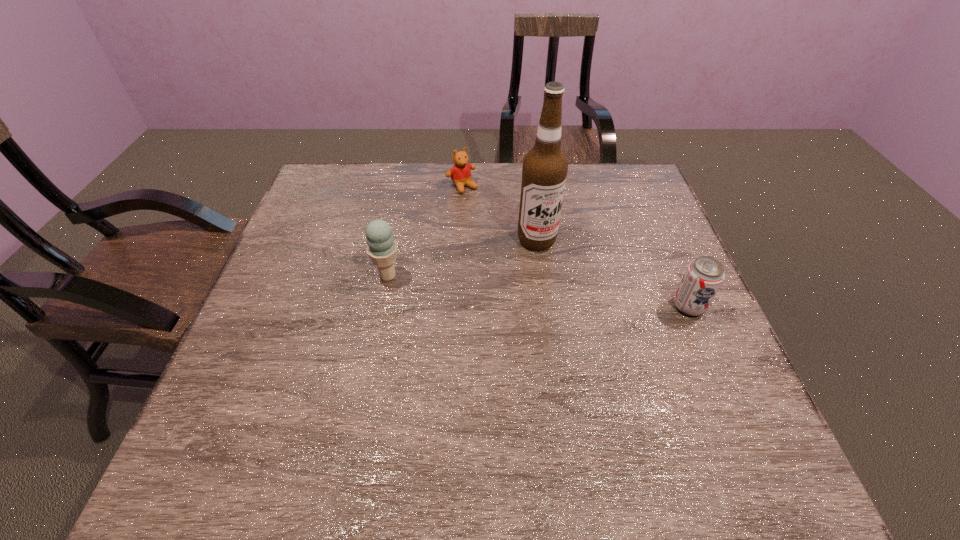
The height and width of the screenshot is (540, 960). What are the coordinates of `vacant space located on the front-facing side of the teddy bear` in the screenshot? It's located at tap(515, 247).

You are a GUI agent. You are given a task and a screenshot of the screen. Output one action in this format:
    pyautogui.click(x=<x>, y=<y>)
    Task: Click on the free location located 0.280m on the front-facing side of the teddy bear
    
    Given the screenshot: What is the action you would take?
    pyautogui.click(x=516, y=249)

Locate an element on the screen. vacant space situated on the front-facing side of the teddy bear is located at coordinates point(494,224).

This screenshot has height=540, width=960. I want to click on vacant region located on the label of the alcohol, so click(x=629, y=375).

Find the location of a particular element. The image size is (960, 540). vacant space located on the label of the alcohol is located at coordinates (581, 305).

The height and width of the screenshot is (540, 960). In order to click on free space located on the label of the alcohol in this screenshot , I will do `click(601, 334)`.

I want to click on object at the far edge, so click(460, 173).

At what (x,y) coordinates should I click in order to perform the action: click on object present at the right edge. Please return your answer as a coordinate pair (x, y). This screenshot has height=540, width=960. Looking at the image, I should click on (704, 276).

Where is `vacant position at the far edge of the desktop`? Image resolution: width=960 pixels, height=540 pixels. vacant position at the far edge of the desktop is located at coordinates (504, 179).

Image resolution: width=960 pixels, height=540 pixels. Find the location of `free space at the near edge`. free space at the near edge is located at coordinates (352, 410).